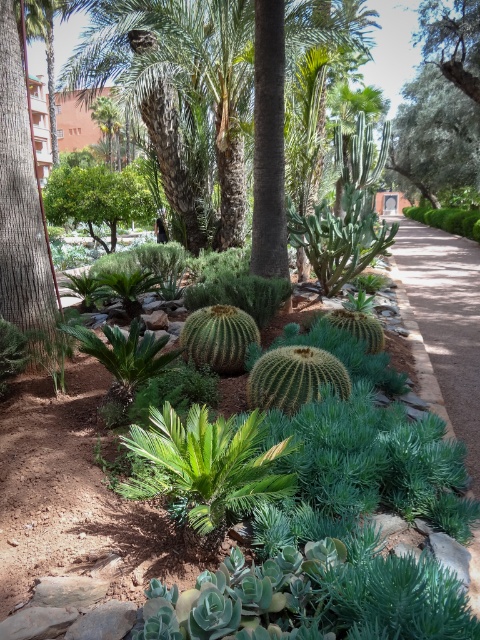
Is green textured tree at left taller than green leafy tree at upper right?

No, green textured tree at left is not taller than green leafy tree at upper right.

Find the location of a particular element. green textured tree at left is located at coordinates (23, 205).

Is green textured tree at left to the right of dirt/gravel pathway at center from the viewer's perspective?

In fact, green textured tree at left is to the left of dirt/gravel pathway at center.

The image size is (480, 640). Find the location of `green textured tree at left`. green textured tree at left is located at coordinates (23, 205).

Which is behind, point (468, 429) or point (472, 10)?

Positioned behind is point (472, 10).

Is point (453, 298) in front of point (431, 19)?

Yes, point (453, 298) is closer to viewer.

Who is more forward, [424,278] or [454,77]?

Point [424,278]

This screenshot has height=640, width=480. I want to click on dirt/gravel pathway at center, so click(446, 317).